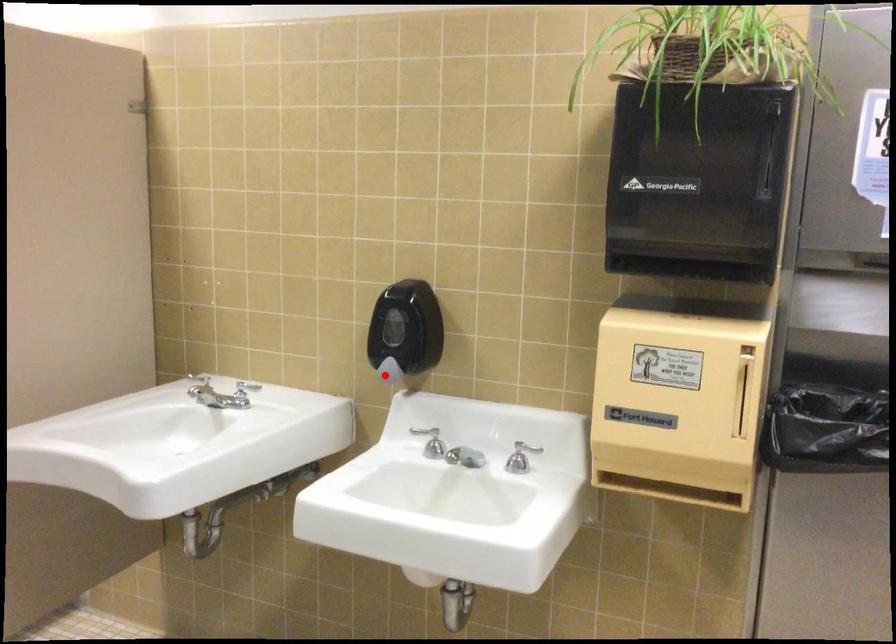
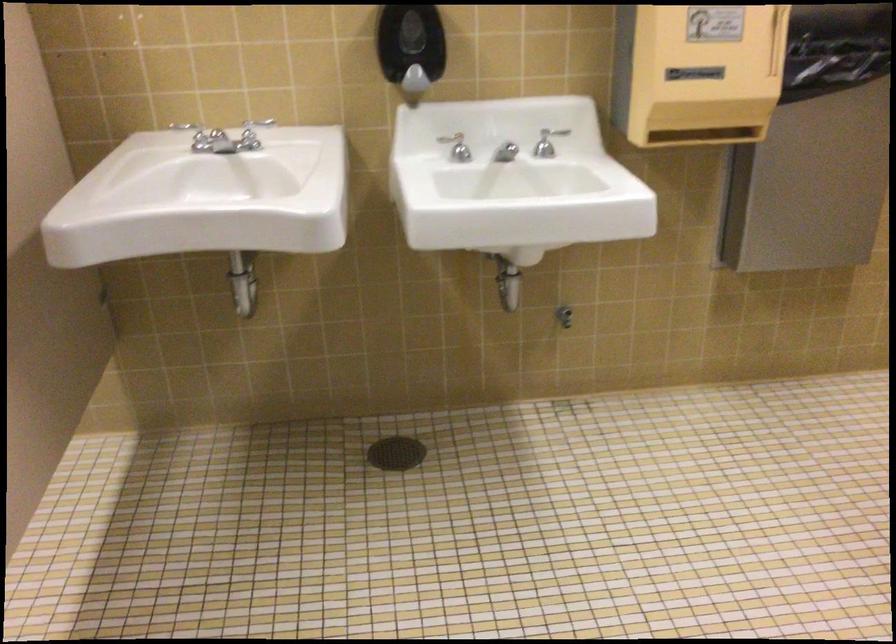
In the second image, find the point that corresponds to the highlighted location in the first image.

(412, 84)